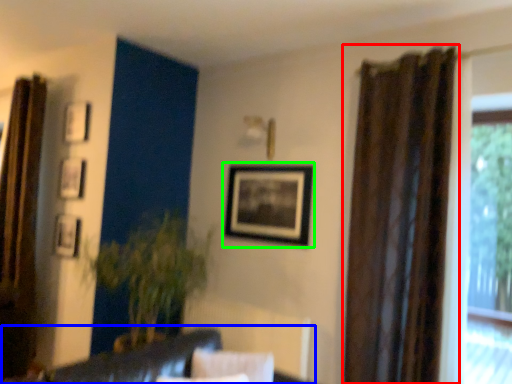
Question: Which is nearer to the curtain (highlighted by a red box)? couch (highlighted by a blue box) or picture frame (highlighted by a green box).

Choices:
 (A) couch
 (B) picture frame

Answer: (B)